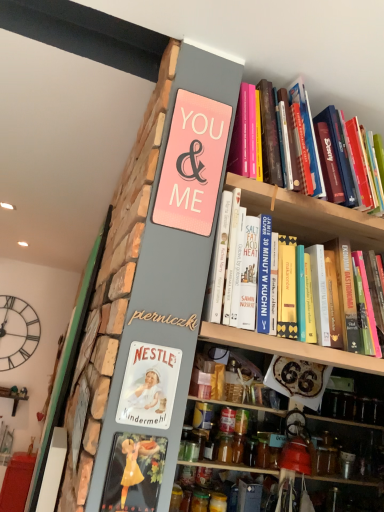
Describe the element at coordinates (165, 319) in the screenshot. I see `gold wood sign at center` at that location.

Where is `gold wood sign at center`? The width and height of the screenshot is (384, 512). gold wood sign at center is located at coordinates (165, 319).

This screenshot has width=384, height=512. Describe the element at coordinates (17, 332) in the screenshot. I see `black metal clock at upper left` at that location.

What do you see at coordinates (218, 502) in the screenshot?
I see `translucent glass jar at lower center, the first glass jar when ordered from right to left` at bounding box center [218, 502].

Identify the location of hardcover book at upper right, positioned as the 1th book in bottom-to-top order. The width and height of the screenshot is (384, 512). (307, 215).

Can you confirm if hardcover book at upper right, positioned as the 1th book in bottom-to-top order, is taller than translucent glass jar at center, the second glass jar viewed from the right?

Indeed, hardcover book at upper right, positioned as the 1th book in bottom-to-top order, has a greater height compared to translucent glass jar at center, the second glass jar viewed from the right.

Can you confirm if hardcover book at upper right, positioned as the 1th book in bottom-to-top order, is bigger than translucent glass jar at center, arranged as the 1th glass jar when viewed from the left?

Yes.

Considering the positions of objects hardcover book at upper right, acting as the second book starting from the top, and translucent glass jar at center, arranged as the 1th glass jar when viewed from the left, in the image provided, who is more to the left, hardcover book at upper right, acting as the second book starting from the top, or translucent glass jar at center, arranged as the 1th glass jar when viewed from the left,?

Positioned to the left is translucent glass jar at center, arranged as the 1th glass jar when viewed from the left.

Does hardcover book at upper right, positioned as the 1th book in bottom-to-top order, turn towards black metal clock at upper left?

No, hardcover book at upper right, positioned as the 1th book in bottom-to-top order, does not turn towards black metal clock at upper left.

From the image's perspective, would you say hardcover book at upper right, acting as the second book starting from the top, is shown under black metal clock at upper left?

No, from the image's perspective, hardcover book at upper right, acting as the second book starting from the top, is not below black metal clock at upper left.

At what (x,y) coordinates should I click in order to perform the action: click on book that is the 1st object to the right of the black metal clock at upper left, starting at the anchor. Please return your answer as a coordinate pair (x, y). Image resolution: width=384 pixels, height=512 pixels. Looking at the image, I should click on (307, 215).

Does hardcover book at upper right, acting as the second book starting from the top, contain black metal clock at upper left?

No, black metal clock at upper left is not surrounded by hardcover book at upper right, acting as the second book starting from the top.

From a real-world perspective, is pink matte sign at upper center over metallic silver sign at lower center?

Yes.

Can you confirm if pink matte sign at upper center is positioned to the left of metallic silver sign at lower center?

In fact, pink matte sign at upper center is to the right of metallic silver sign at lower center.

Consider the image. How many degrees apart are the facing directions of pink matte sign at upper center and metallic silver sign at lower center?

They differ by 0.00989 degrees in their facing directions.

Is pink matte sign at upper center inside or outside of metallic silver sign at lower center?

pink matte sign at upper center is spatially situated outside metallic silver sign at lower center.

Looking at this image, is gold wood sign at center oriented towards hardcover book at upper right, positioned as the 1th book in bottom-to-top order?

No, gold wood sign at center is not facing towards hardcover book at upper right, positioned as the 1th book in bottom-to-top order.

Is gold wood sign at center to the right of hardcover book at upper right, positioned as the 1th book in bottom-to-top order, from the viewer's perspective?

No.

Is gold wood sign at center next to hardcover book at upper right, acting as the second book starting from the top?

No, gold wood sign at center is not with hardcover book at upper right, acting as the second book starting from the top.

Is point (194, 317) positioned behind point (271, 193)?

No.

Can you confirm if translucent glass jar at lower center, the first glass jar when ordered from right to left, is wider than gold wood sign at center?

Indeed, translucent glass jar at lower center, the first glass jar when ordered from right to left, has a greater width compared to gold wood sign at center.

From the image's perspective, would you say translucent glass jar at lower center, which appears as the 2th glass jar when viewed from the left, is shown under gold wood sign at center?

Yes.

Is translucent glass jar at lower center, the first glass jar when ordered from right to left, to the left or to the right of gold wood sign at center in the image?

translucent glass jar at lower center, the first glass jar when ordered from right to left, is positioned on gold wood sign at center's right side.

Is translucent glass jar at lower center, which appears as the 2th glass jar when viewed from the left, in front of or behind gold wood sign at center in the image?

Clearly, translucent glass jar at lower center, which appears as the 2th glass jar when viewed from the left, is behind gold wood sign at center.

Starting from the gold wood sign at center, which glass jar is the 2nd one to the right? Please provide its 2D coordinates.

[(218, 502)]

Are gold wood sign at center and translucent glass jar at lower center, which appears as the 2th glass jar when viewed from the left, far apart?

Indeed, gold wood sign at center is not near translucent glass jar at lower center, which appears as the 2th glass jar when viewed from the left.

Which point is more forward, [143,318] or [226,507]?

The point [143,318] is in front.

In order to click on shelf below the gold wood sign at center (from the image's perspective) in this screenshot , I will do `click(352, 454)`.

Which is farther from the camera, (356,488) or (151,314)?

Positioned behind is point (356,488).

Based on the photo, from a real-world perspective, which object stands above the other?

gold wood sign at center is physically above.

Which glass jar is the 2nd one when counting from the left side of the hardcover book at upper right, positioned as the 1th book in bottom-to-top order? Please provide its 2D coordinates.

[(199, 501)]

This screenshot has width=384, height=512. I want to click on the 1st book above the black metal clock at upper left (from a real-world perspective), so click(x=307, y=215).

When comparing their distances from translucent glass jar at lower center, the first glass jar when ordered from right to left, does black metal clock at upper left or metallic silver sign at lower center seem closer?

Among the two, metallic silver sign at lower center is located nearer to translucent glass jar at lower center, the first glass jar when ordered from right to left.

Considering their positions, is metallic silver sign at lower center positioned closer to hardcover books at upper right, which is counted as the second book, starting from the bottom, than wooden shelf at center?

metallic silver sign at lower center lies closer to hardcover books at upper right, which is counted as the second book, starting from the bottom, than the other object.

When comparing their distances from pink matte sign at upper center, does hardcover books at upper right, which is counted as the second book, starting from the bottom, or translucent glass jar at lower center, which appears as the 2th glass jar when viewed from the left, seem further?

translucent glass jar at lower center, which appears as the 2th glass jar when viewed from the left, lies further to pink matte sign at upper center than the other object.

Consider the image. Looking at the image, which one is located further to wooden shelf at center, translucent glass jar at center, arranged as the 1th glass jar when viewed from the left, or hardcover books at upper right, which is counted as the second book, starting from the bottom?

hardcover books at upper right, which is counted as the second book, starting from the bottom, is positioned further to the anchor wooden shelf at center.

Based on the photo, considering their positions, is metallic silver sign at lower center positioned further to black metal clock at upper left than hardcover book at upper right, positioned as the 1th book in bottom-to-top order?

metallic silver sign at lower center.

From the image, which object appears to be nearer to translucent glass jar at center, arranged as the 1th glass jar when viewed from the left, black metal clock at upper left or translucent glass jar at lower center, which appears as the 2th glass jar when viewed from the left?

translucent glass jar at lower center, which appears as the 2th glass jar when viewed from the left.

From the image, which object appears to be nearer to black metal clock at upper left, hardcover book at upper right, acting as the second book starting from the top, or wooden shelf at center?

wooden shelf at center is positioned closer to the anchor black metal clock at upper left.

Estimate the real-world distances between objects in this image. Which object is closer to hardcover books at upper right, which is counted as the second book, starting from the bottom, gold wood sign at center or pink matte sign at upper center?

The object closer to hardcover books at upper right, which is counted as the second book, starting from the bottom, is pink matte sign at upper center.

Locate an element on the screen. This screenshot has height=512, width=384. book between gold wood sign at center and hardcover books at upper right, which is counted as the second book, starting from the bottom, in the horizontal direction is located at coordinates (307, 215).

Identify the location of glass jar between translucent glass jar at center, the second glass jar viewed from the right, and wooden shelf at center, in the horizontal direction. (218, 502).

Where is `book cover between hardcover books at upper right, which is counted as the first book, starting from the top, and translucent glass jar at lower center, which appears as the 2th glass jar when viewed from the left, in the vertical direction`? book cover between hardcover books at upper right, which is counted as the first book, starting from the top, and translucent glass jar at lower center, which appears as the 2th glass jar when viewed from the left, in the vertical direction is located at coordinates (149, 386).

Identify the location of book cover between pink matte sign at upper center and wooden shelf at center in the up-down direction. The height and width of the screenshot is (512, 384). (149, 386).